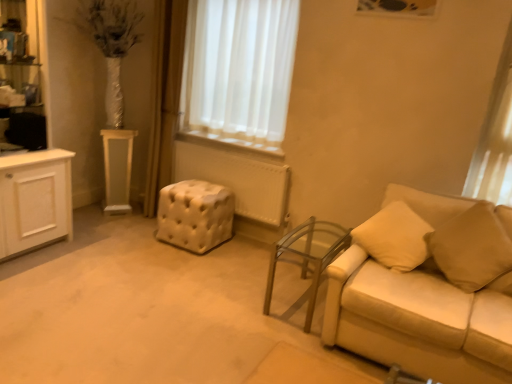
Question: Is beige fabric pillow at right oriented away from beige leather couch at right?

Choices:
 (A) no
 (B) yes

Answer: (B)

Question: From a real-world perspective, is beige fabric pillow at right physically above beige leather couch at right?

Choices:
 (A) no
 (B) yes

Answer: (B)

Question: Can you confirm if beige fabric pillow at right is shorter than beige leather couch at right?

Choices:
 (A) no
 (B) yes

Answer: (B)

Question: From a real-world perspective, is beige fabric pillow at right located beneath beige leather couch at right?

Choices:
 (A) no
 (B) yes

Answer: (A)

Question: Does beige fabric pillow at right turn towards beige leather couch at right?

Choices:
 (A) no
 (B) yes

Answer: (B)

Question: Can you confirm if beige fabric pillow at right is positioned to the right of beige leather couch at right?

Choices:
 (A) no
 (B) yes

Answer: (B)

Question: Is beige leather couch at right facing towards transparent glass table at lower right, which appears as the 1th table when ordered from the bottom?

Choices:
 (A) no
 (B) yes

Answer: (A)

Question: Considering the relative sizes of beige leather couch at right and transparent glass table at lower right, the 1th table from the right, in the image provided, is beige leather couch at right shorter than transparent glass table at lower right, the 1th table from the right,?

Choices:
 (A) no
 (B) yes

Answer: (A)

Question: Is beige leather couch at right outside of transparent glass table at lower right, the 1th table from the right?

Choices:
 (A) no
 (B) yes

Answer: (B)

Question: Is beige leather couch at right to the left of transparent glass table at lower right, which is counted as the second table, starting from the top, from the viewer's perspective?

Choices:
 (A) no
 (B) yes

Answer: (A)

Question: From a real-world perspective, is beige leather couch at right under transparent glass table at lower right, which is counted as the second table, starting from the top?

Choices:
 (A) no
 (B) yes

Answer: (A)

Question: Is beige leather couch at right bigger than transparent glass table at lower right, which is counted as the second table, starting from the top?

Choices:
 (A) yes
 (B) no

Answer: (A)

Question: Is beige fabric pillow at right oriented away from transparent glass table at lower right, marked as the second table in a left-to-right arrangement?

Choices:
 (A) no
 (B) yes

Answer: (A)